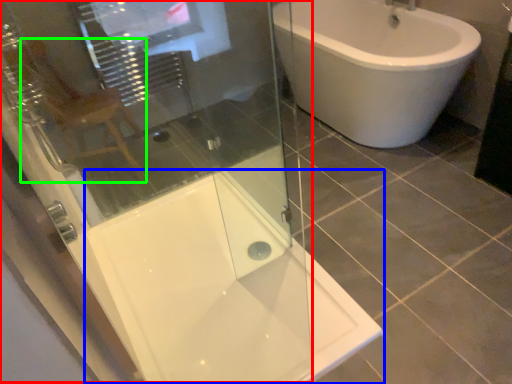
Question: Which is nearer to the screen door (highlighted by a red box)? bath (highlighted by a blue box) or gray (highlighted by a green box).

Choices:
 (A) bath
 (B) gray

Answer: (A)